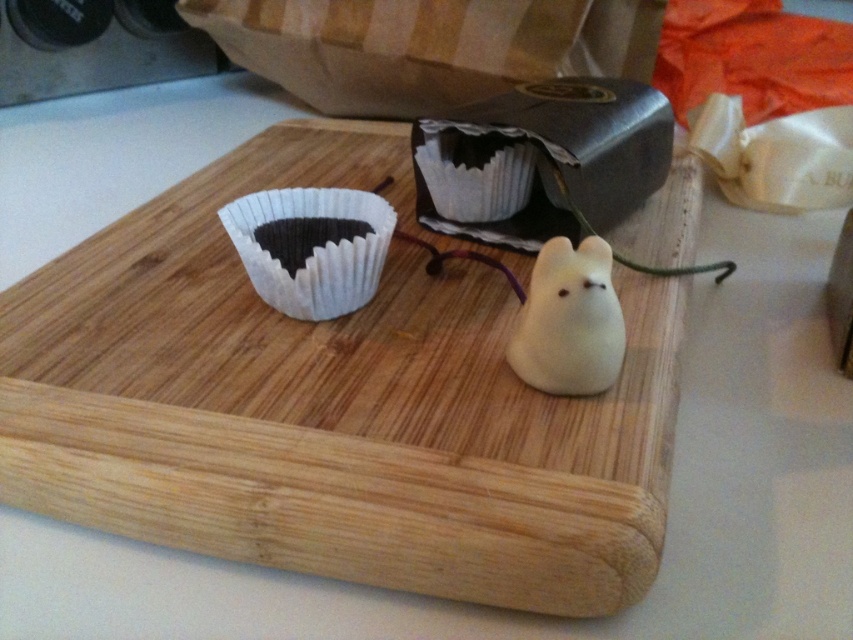
Can you confirm if wooden cutting board at center is positioned above matte white paper cupcake at center?

No.

Is wooden cutting board at center in front of matte white paper cupcake at center?

Yes, it is in front of matte white paper cupcake at center.

Locate an element on the screen. This screenshot has height=640, width=853. wooden cutting board at center is located at coordinates (331, 404).

Find the location of `wooden cutting board at center`. wooden cutting board at center is located at coordinates (331, 404).

Which of these two, wooden cutting board at center or white matte mouse at center, stands shorter?

Standing shorter between the two is white matte mouse at center.

Is wooden cutting board at center wider than white matte mouse at center?

Yes.

This screenshot has width=853, height=640. I want to click on wooden cutting board at center, so click(x=331, y=404).

Where is `wooden cutting board at center`? Image resolution: width=853 pixels, height=640 pixels. wooden cutting board at center is located at coordinates (331, 404).

Who is more forward, (230, 552) or (242, 232)?

Positioned in front is point (230, 552).

Does wooden cutting board at center appear on the right side of white paper cupcake at upper left?

Correct, you'll find wooden cutting board at center to the right of white paper cupcake at upper left.

This screenshot has height=640, width=853. I want to click on wooden cutting board at center, so click(x=331, y=404).

Where is `wooden cutting board at center`? wooden cutting board at center is located at coordinates (331, 404).